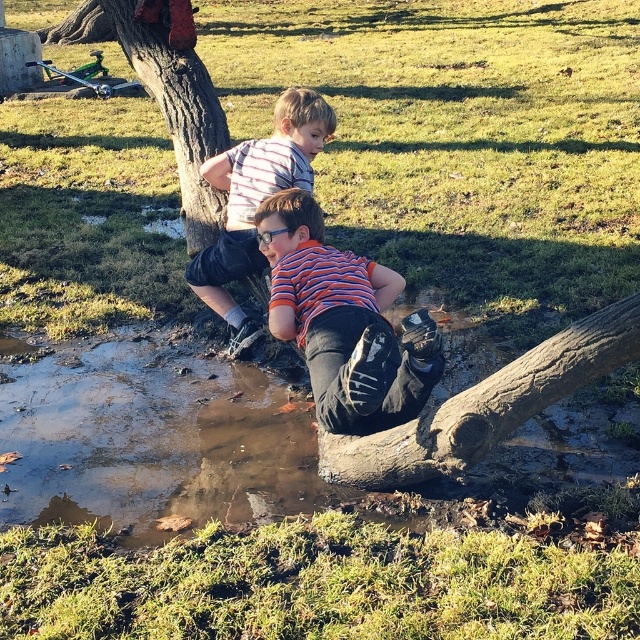
You are a parent watching the two boys playing. You notice the orange striped shirt at center and the brown rough tree trunk at upper left. Which object is closer to you?

The orange striped shirt at center is closer to you because it is positioned under the brown rough tree trunk at upper left, indicating it is lower in the scene and thus nearer.

Based on the scene described, where is the brown rough log at lower center located relative to the striped shirt at center?

The brown rough log at lower center is to the right of the striped shirt at center.